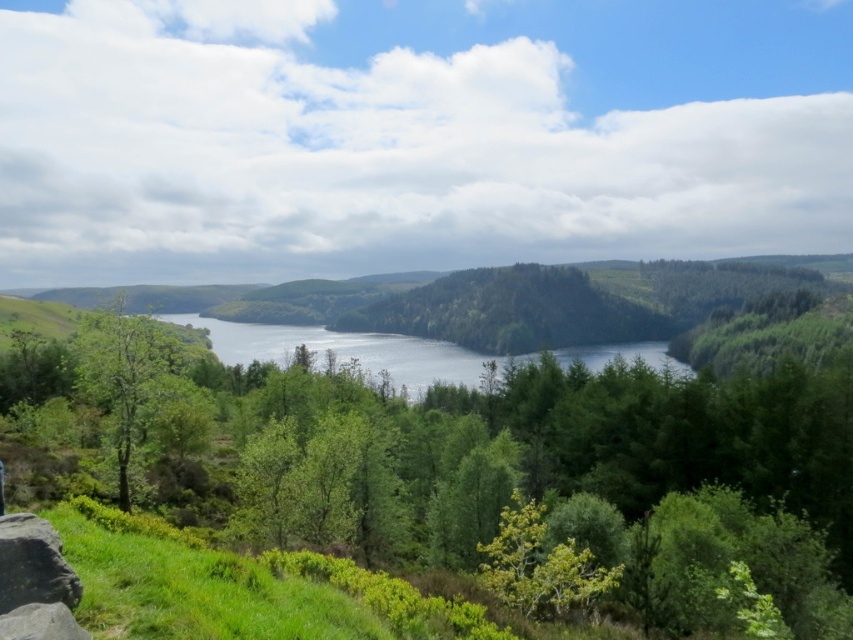
Is clear blue water at center above smooth gray rock at lower left?

Actually, clear blue water at center is below smooth gray rock at lower left.

Who is positioned more to the right, clear blue water at center or smooth gray rock at lower left?

From the viewer's perspective, smooth gray rock at lower left appears more on the right side.

Who is more distant from viewer, [392,348] or [54,596]?

Positioned behind is point [392,348].

Where is `clear blue water at center`? clear blue water at center is located at coordinates (349, 349).